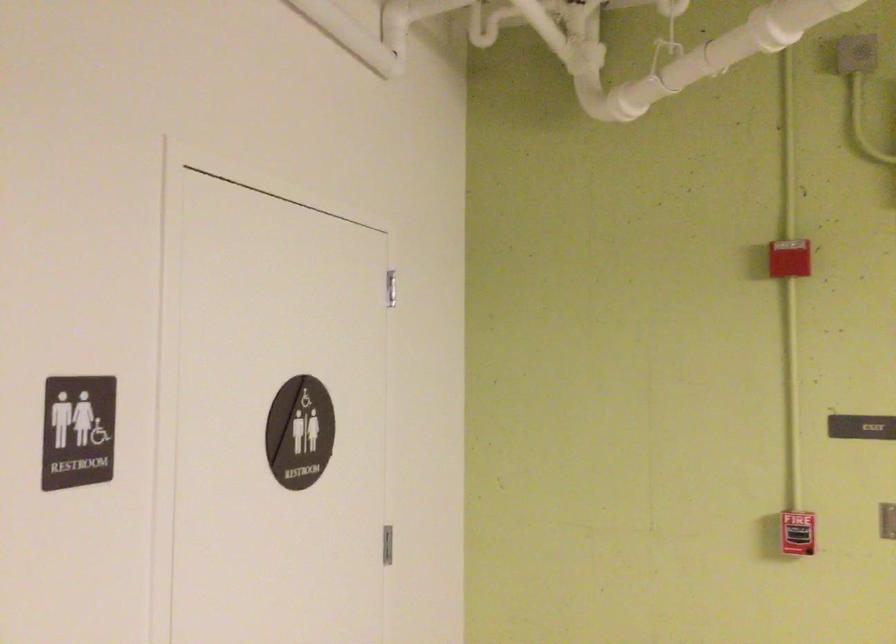
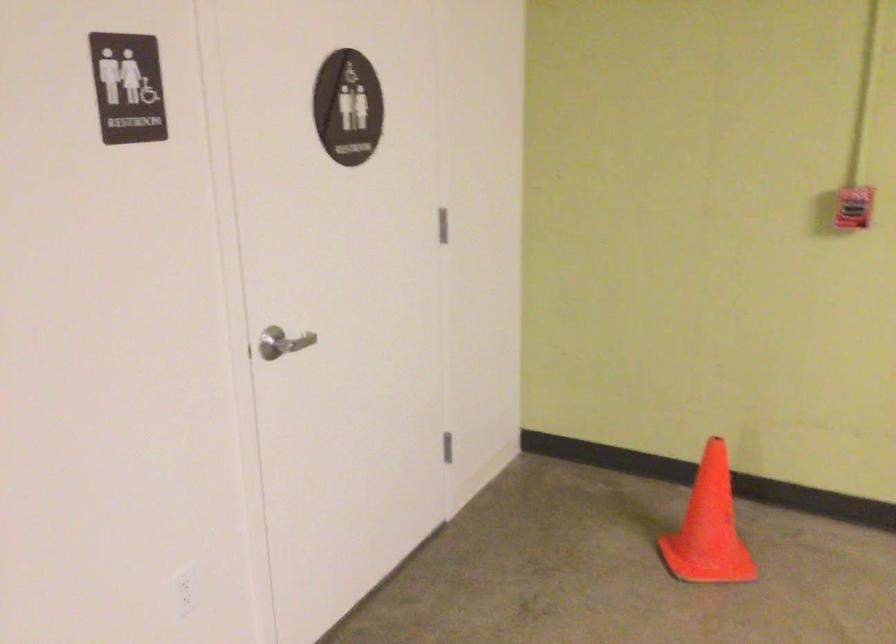
Locate, in the second image, the point that corresponds to [798,532] in the first image.

(854, 207)